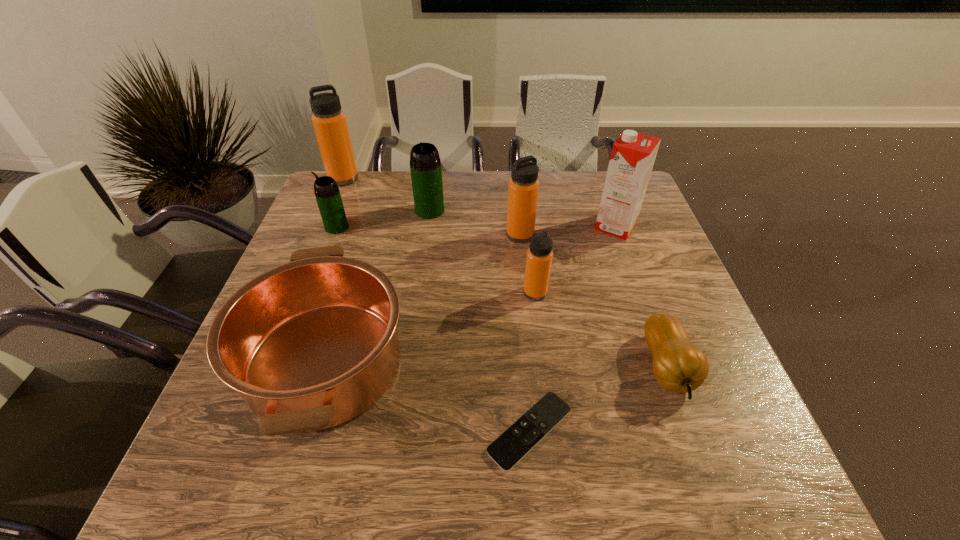
Identify the location of vacant region that satisfies the following two spatial constraints: 1. from the spout of the smaller green thermos bottle; 2. on the back side of the nearest orange thermos bottle. (312, 293).